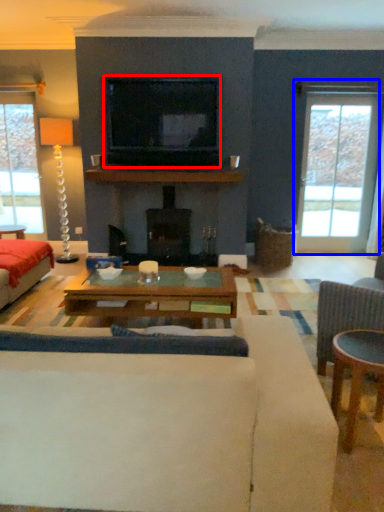
Question: Which of the following is the closest to the observer, television (highlighted by a red box) or window (highlighted by a blue box)?

Choices:
 (A) television
 (B) window

Answer: (A)